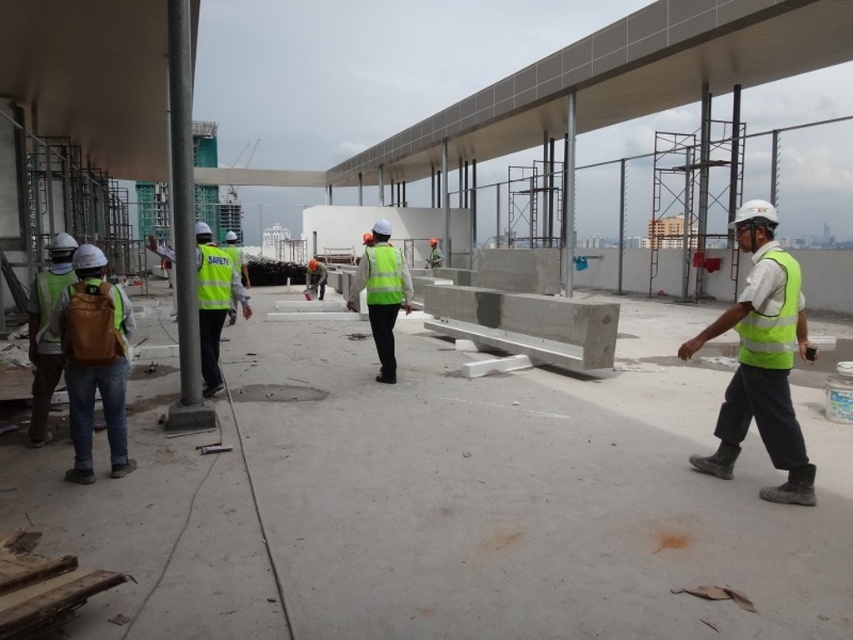
You are a safety inspector at the construction site. You notice two safety vests in the image. Which one is shorter in height between the brown fabric vest at left and the yellow reflective safety vest at center?

The brown fabric vest at left is shorter in height compared to the yellow reflective safety vest at center.